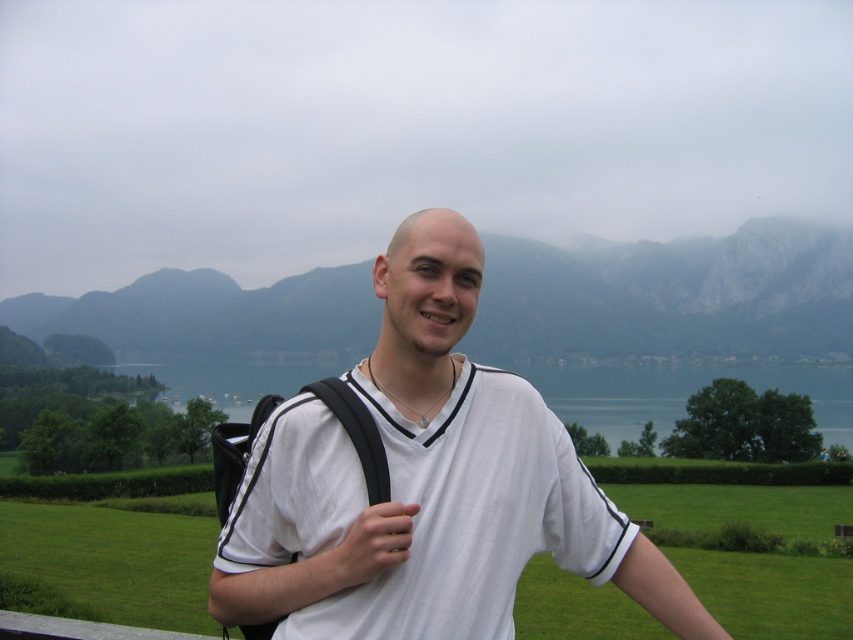
Who is more distant from viewer, [573,461] or [723,314]?

The point [723,314] is behind.

Find the location of a particular element. This screenshot has width=853, height=640. white cotton t-shirt at center is located at coordinates (426, 484).

Where is `white cotton t-shirt at center`? The image size is (853, 640). white cotton t-shirt at center is located at coordinates (426, 484).

Is green rocky mountain at upper center taller than green water at center?

Indeed, green rocky mountain at upper center has a greater height compared to green water at center.

Does green rocky mountain at upper center have a lesser width compared to green water at center?

No, green rocky mountain at upper center is not thinner than green water at center.

Identify the location of green rocky mountain at upper center. (674, 294).

At what (x,y) coordinates should I click in order to perform the action: click on white cotton t-shirt at center. Please return your answer as a coordinate pair (x, y). Looking at the image, I should click on (426, 484).

Between white cotton t-shirt at center and green water at center, which one appears on the left side from the viewer's perspective?

green water at center is more to the left.

You are a GUI agent. You are given a task and a screenshot of the screen. Output one action in this format:
    pyautogui.click(x=<x>, y=<y>)
    Task: Click on the white cotton t-shirt at center
    The image size is (853, 640).
    Given the screenshot: What is the action you would take?
    pos(426,484)